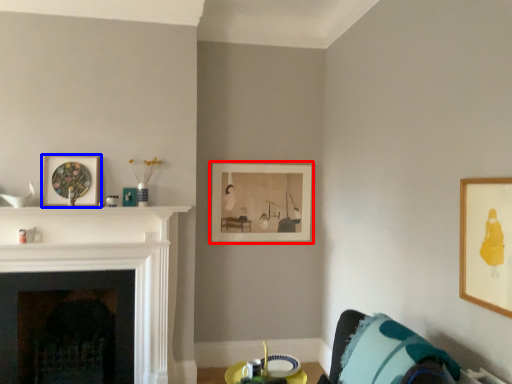
Question: Among these objects, which one is farthest to the camera, picture frame (highlighted by a red box) or picture frame (highlighted by a blue box)?

Choices:
 (A) picture frame
 (B) picture frame

Answer: (A)